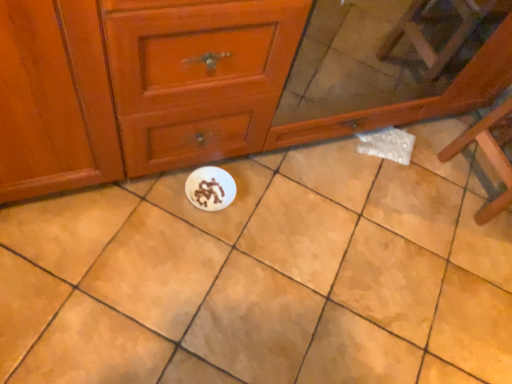
The image size is (512, 384). I want to click on blank space situated above white glossy plate at center (from a real-world perspective), so click(303, 255).